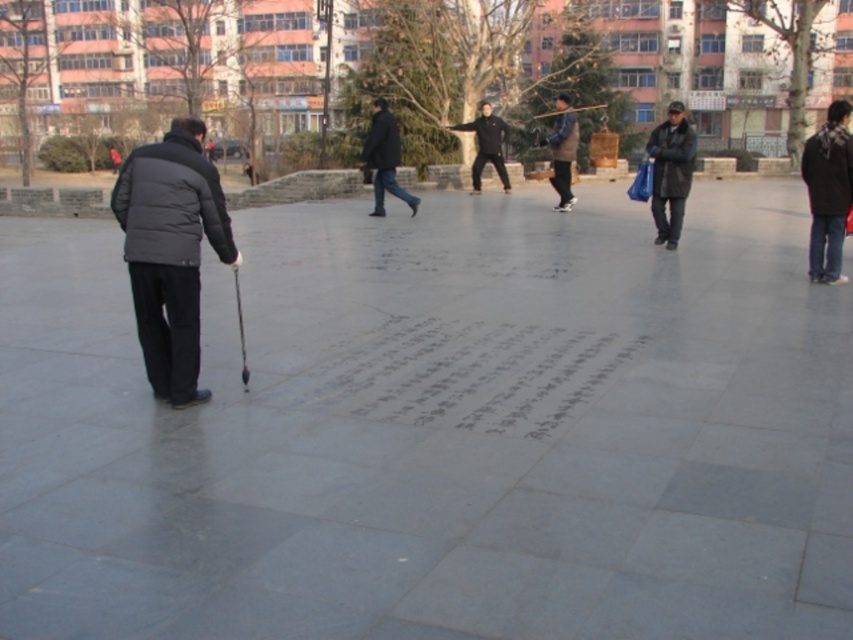
Which is more to the right, dark gray matte jacket at left or brown fuzzy coat at center?

brown fuzzy coat at center is more to the right.

At what (x,y) coordinates should I click in order to perform the action: click on dark gray matte jacket at left. Please return your answer as a coordinate pair (x, y). Looking at the image, I should click on (170, 252).

Is point (131, 234) positioned in front of point (567, 141)?

Yes, point (131, 234) is in front of point (567, 141).

Where is `dark gray matte jacket at left`? The height and width of the screenshot is (640, 853). dark gray matte jacket at left is located at coordinates (170, 252).

Between point (683, 132) and point (364, 161), which one is positioned behind?

Point (364, 161)

Can you confirm if dark brown leather jacket at right is taller than dark gray jacket at center?

Yes.

The width and height of the screenshot is (853, 640). I want to click on dark brown leather jacket at right, so click(670, 172).

Does point (364, 152) lie behind point (560, 193)?

No, it is not.

Which is more to the left, dark gray jacket at center or brown fuzzy coat at center?

dark gray jacket at center

Which is behind, point (384, 212) or point (561, 102)?

Positioned behind is point (384, 212).

The image size is (853, 640). Find the location of `dark gray jacket at center`. dark gray jacket at center is located at coordinates (384, 157).